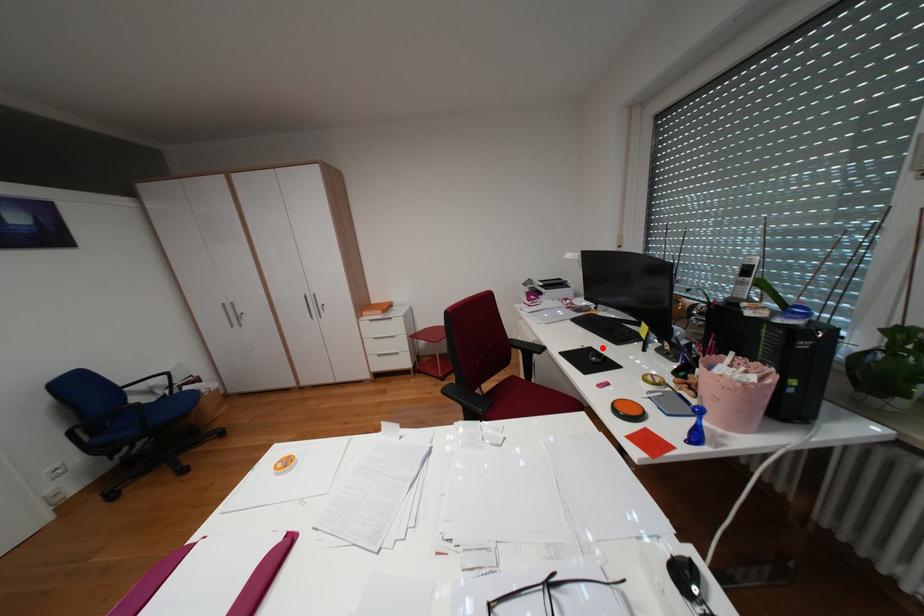
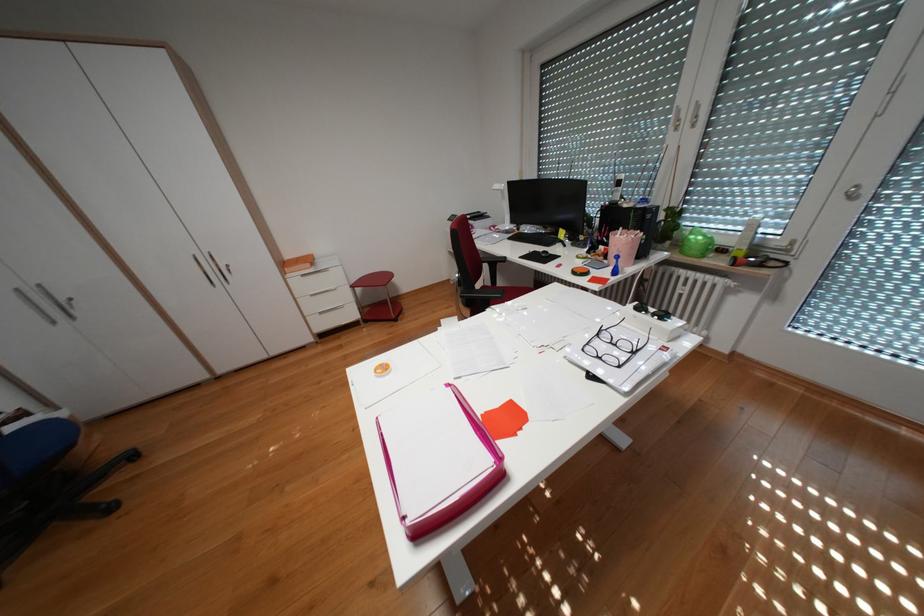
Find the pixel in the second image that matches the highlighted location in the first image.

(546, 252)